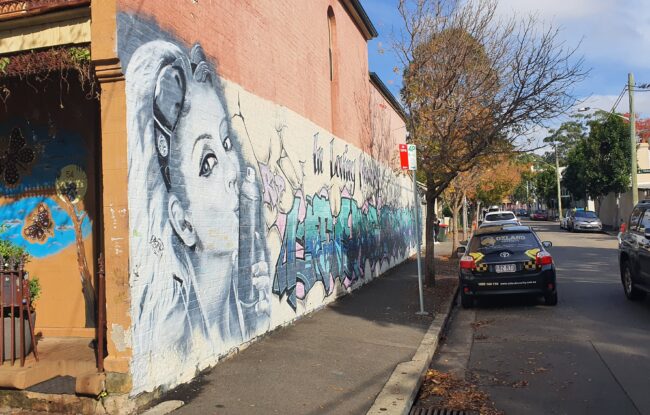
Locate an element on the screen. painting of a woman is located at coordinates pos(218,198).